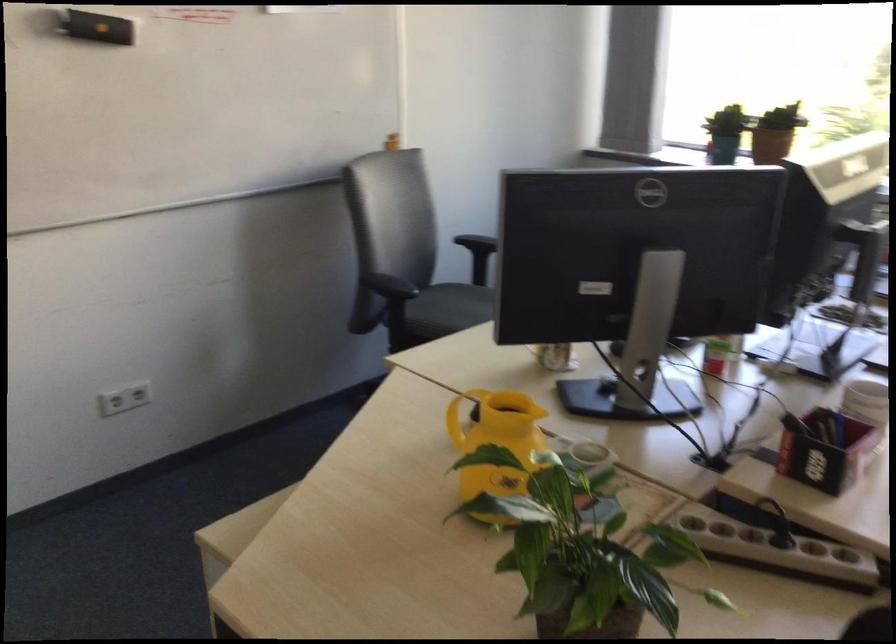
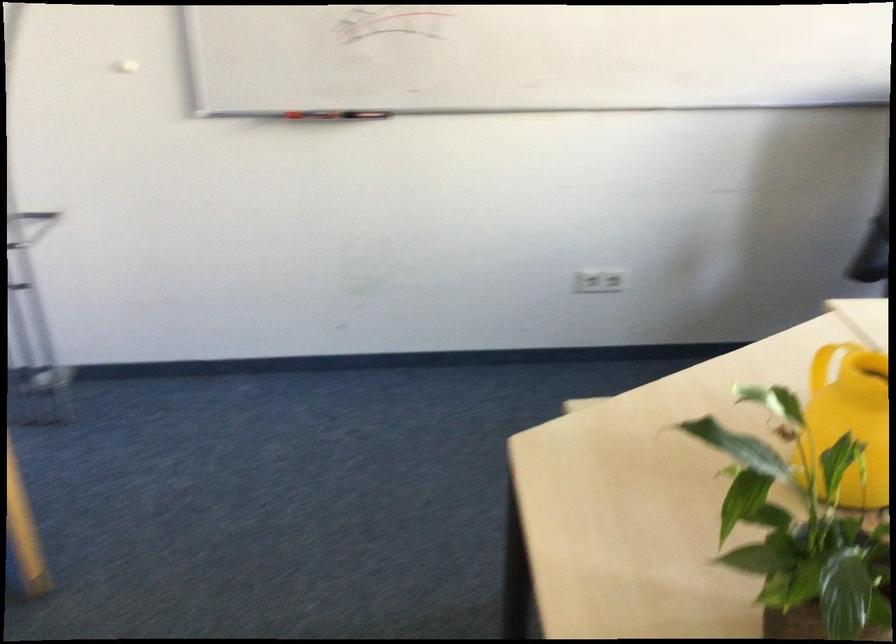
Question: The first image is from the beginning of the video and the second image is from the end. How did the camera likely rotate when shooting the video?

Choices:
 (A) Left
 (B) Right
 (C) Up
 (D) Down

Answer: (A)